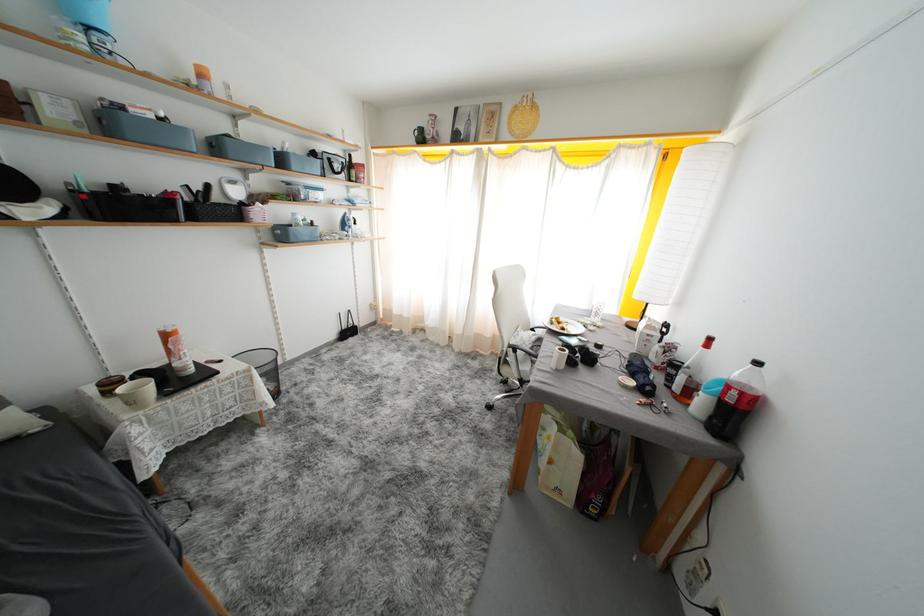
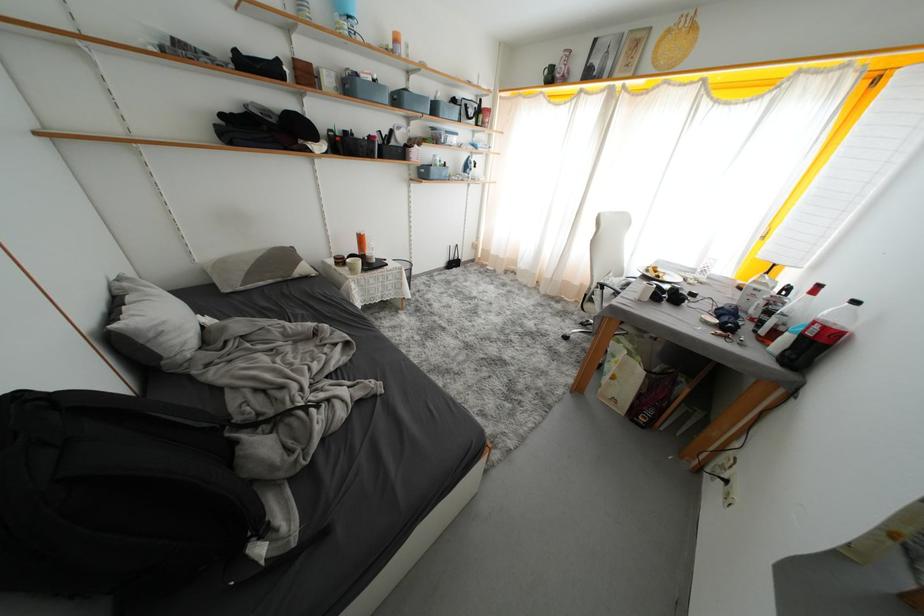
In the second image, find the point that corresponds to pixel 289 238 in the first image.

(431, 177)